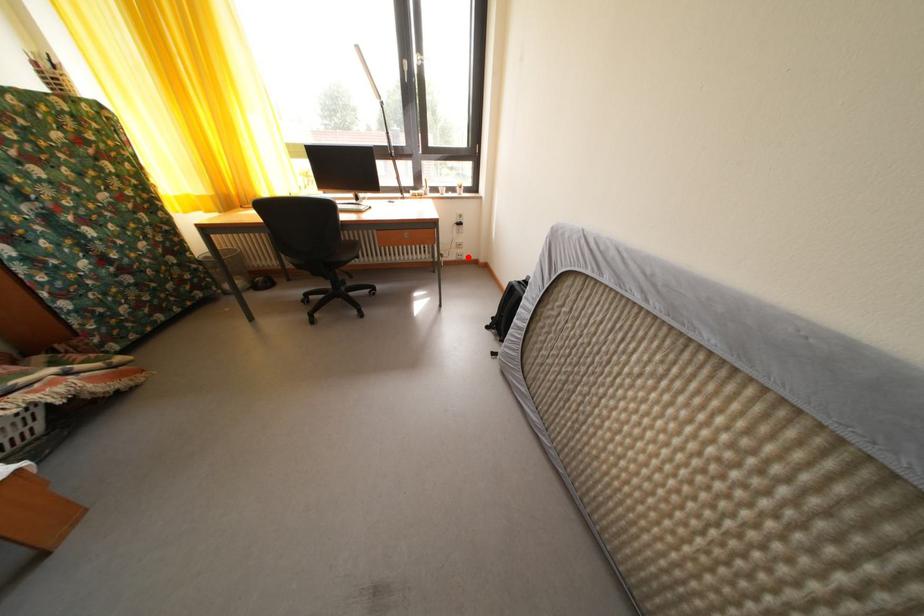
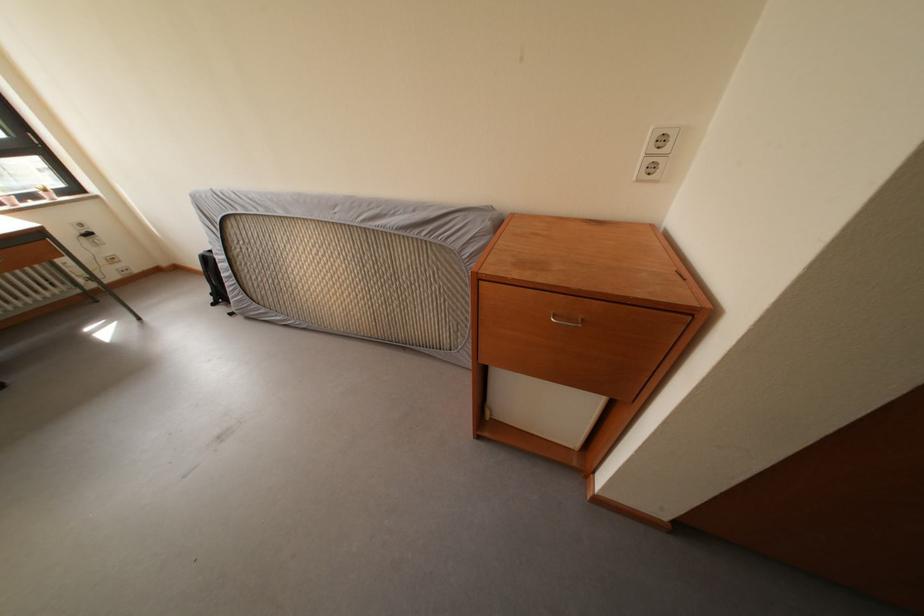
Where in the second image is the point corresponding to the highlighted location from the first image?

(128, 273)